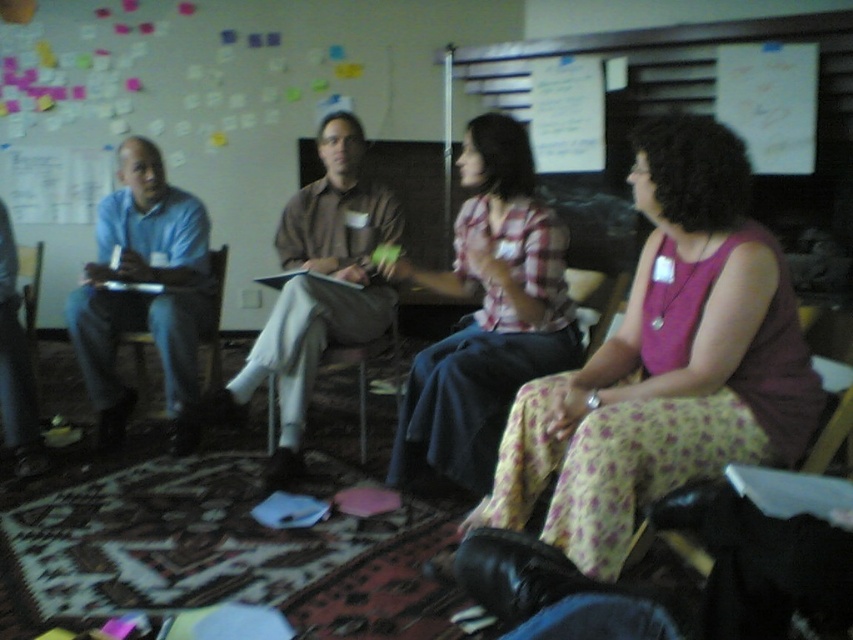
Question: Which point is closer to the camera?

Choices:
 (A) (650, 122)
 (B) (213, 324)
 (C) (236, 397)
 (D) (550, 316)

Answer: (A)

Question: Is plaid fabric shirt at center smaller than matte brown shirt at center?

Choices:
 (A) yes
 (B) no

Answer: (B)

Question: Is floral print skirt at center bigger than matte blue shirt at left?

Choices:
 (A) yes
 (B) no

Answer: (A)

Question: Which point is farther to the camera?

Choices:
 (A) matte wood armchair at left
 (B) plaid fabric shirt at center
 (C) floral print skirt at center
 (D) matte blue shirt at left

Answer: (A)

Question: Does floral print skirt at center have a larger size compared to plaid fabric shirt at center?

Choices:
 (A) no
 (B) yes

Answer: (B)

Question: Which of the following is the farthest from the observer?

Choices:
 (A) matte blue shirt at left
 (B) plaid fabric shirt at center
 (C) floral print skirt at center

Answer: (A)